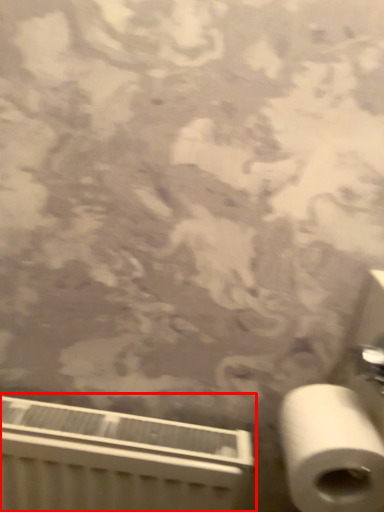
Question: From the image's perspective, what is the correct spatial positioning of radiator (annotated by the red box) in reference to toilet paper?

Choices:
 (A) below
 (B) above

Answer: (A)